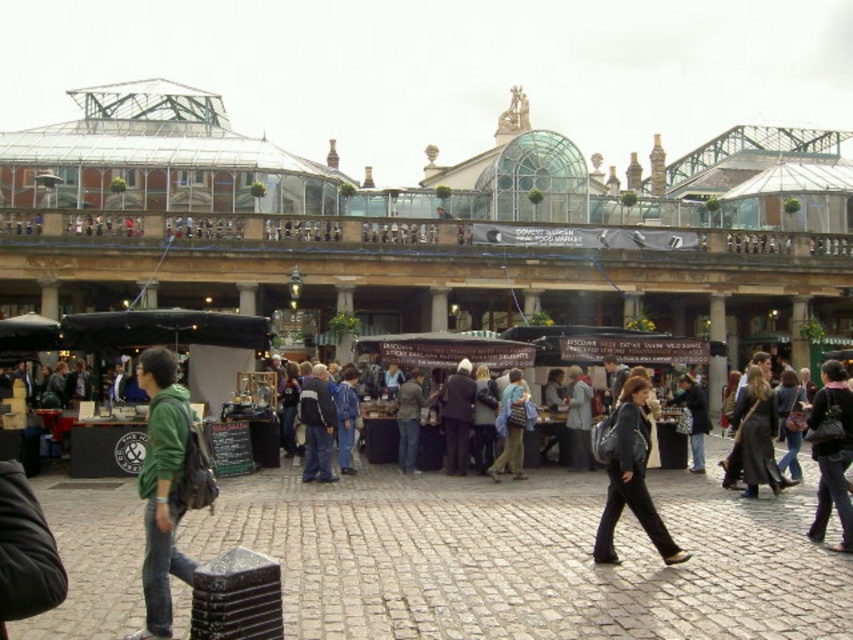
Is dark gray leather jacket at center positioned behind dark brown leather coat at center?

No, dark gray leather jacket at center is in front of dark brown leather coat at center.

Who is higher up, dark gray leather jacket at center or dark brown leather coat at center?

dark gray leather jacket at center

Locate an element on the screen. This screenshot has height=640, width=853. dark gray leather jacket at center is located at coordinates (628, 474).

Does dark blue jeans at lower right have a greater height compared to denim jacket at center?

Yes.

Between point (837, 420) and point (508, 458), which one is positioned in front?

Point (837, 420) is in front.

Describe the element at coordinates (831, 452) in the screenshot. I see `dark blue jeans at lower right` at that location.

You are a GUI agent. You are given a task and a screenshot of the screen. Output one action in this format:
    pyautogui.click(x=<x>, y=<y>)
    Task: Click on the dark blue jeans at lower right
    The height and width of the screenshot is (640, 853).
    Given the screenshot: What is the action you would take?
    pyautogui.click(x=831, y=452)

Can you confirm if green matte jacket at center is thinner than denim jacket at center?

In fact, green matte jacket at center might be wider than denim jacket at center.

Can you confirm if green matte jacket at center is wider than denim jacket at center?

Yes, green matte jacket at center is wider than denim jacket at center.

What do you see at coordinates (167, 484) in the screenshot? The image size is (853, 640). I see `green matte jacket at center` at bounding box center [167, 484].

Image resolution: width=853 pixels, height=640 pixels. I want to click on green matte jacket at center, so click(x=167, y=484).